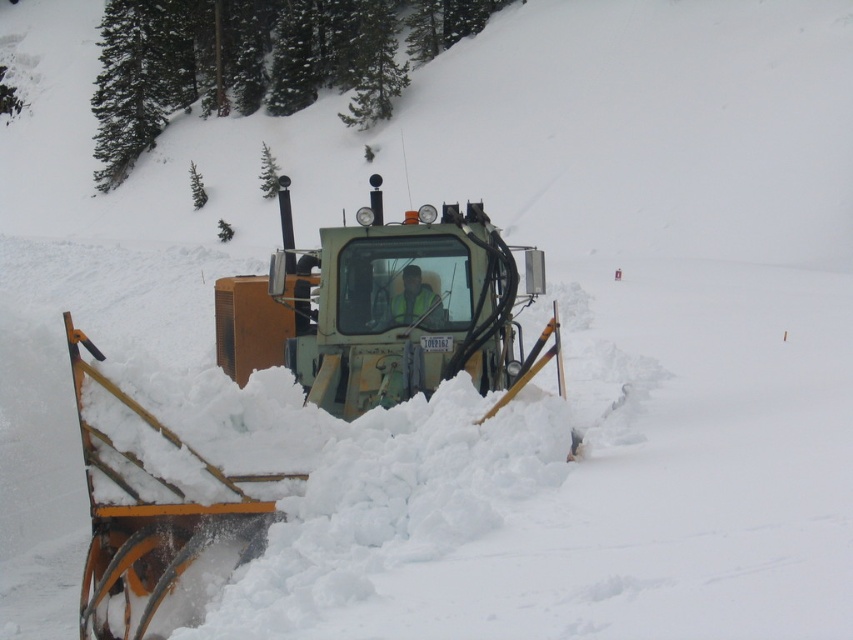
Question: Is green matte snowplow at center closer to the viewer compared to reflective yellow vest at center?

Choices:
 (A) no
 (B) yes

Answer: (B)

Question: Is green matte snowplow at center smaller than reflective yellow vest at center?

Choices:
 (A) no
 (B) yes

Answer: (A)

Question: Is green matte snowplow at center positioned at the back of reflective yellow vest at center?

Choices:
 (A) yes
 (B) no

Answer: (B)

Question: Among these points, which one is nearest to the camera?

Choices:
 (A) (422, 314)
 (B) (387, 403)

Answer: (B)